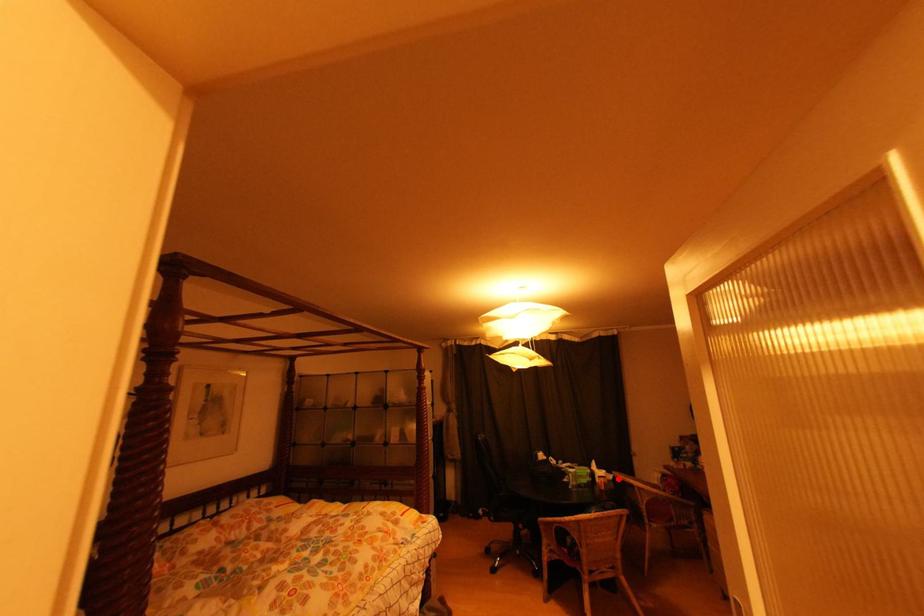
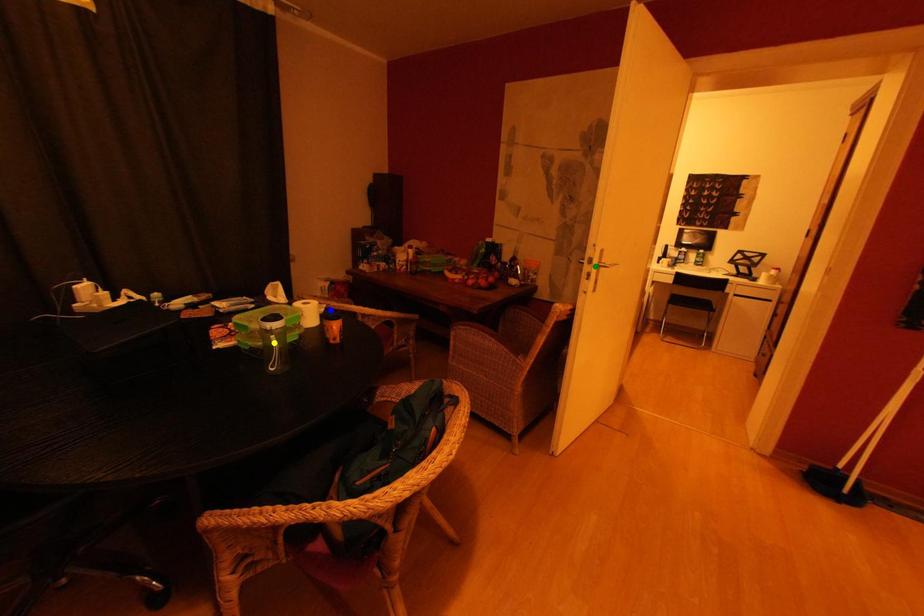
Question: I am providing you with two images of the same scene from different viewpoints. A red point is marked on the first image. You are given multiple points on the second image. Which mark in image 2 goes with the point in image 1?

Choices:
 (A) yellow point
 (B) green point
 (C) blue point

Answer: (C)